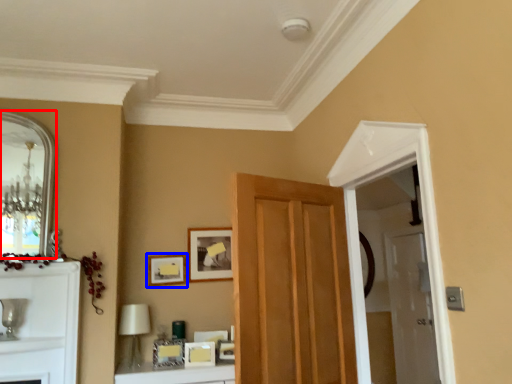
Question: Which of the following is the farthest to the observer, mirror (highlighted by a red box) or picture frame (highlighted by a blue box)?

Choices:
 (A) mirror
 (B) picture frame

Answer: (B)